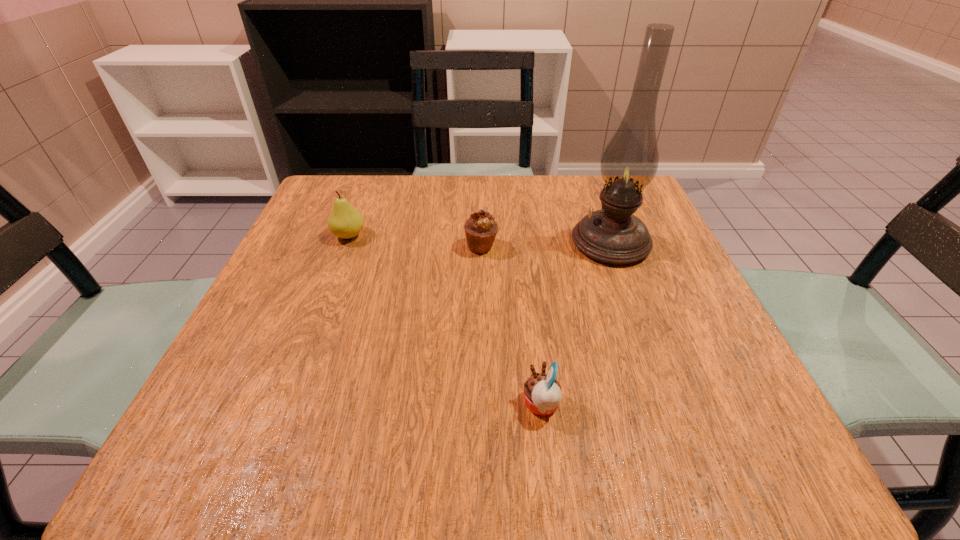
Where is `blank region between the farther muffin and the leftmost object`? This screenshot has height=540, width=960. blank region between the farther muffin and the leftmost object is located at coordinates (415, 241).

Where is `vacant area that lies between the oil lamp and the third object from left to right`? vacant area that lies between the oil lamp and the third object from left to right is located at coordinates (576, 323).

You are a GUI agent. You are given a task and a screenshot of the screen. Output one action in this format:
    pyautogui.click(x=<x>, y=<y>)
    Task: Click on the free space that is in between the leftmost object and the third object from right to left
    Image resolution: width=960 pixels, height=540 pixels.
    Given the screenshot: What is the action you would take?
    (415, 241)

Locate an element on the screen. This screenshot has height=540, width=960. vacant space that is in between the leftmost object and the farther muffin is located at coordinates (415, 241).

At what (x,y) coordinates should I click in order to perform the action: click on free space between the farther muffin and the pear. Please return your answer as a coordinate pair (x, y). This screenshot has height=540, width=960. Looking at the image, I should click on (415, 241).

At what (x,y) coordinates should I click in order to perform the action: click on the third closest object to the rightmost object. Please return your answer as a coordinate pair (x, y). Image resolution: width=960 pixels, height=540 pixels. Looking at the image, I should click on (345, 221).

Locate an element on the screen. The height and width of the screenshot is (540, 960). object identified as the third closest to the left muffin is located at coordinates 542,392.

Find the location of a particular element. The image size is (960, 540). vacant space that satisfies the following two spatial constraints: 1. on the front side of the leftmost object; 2. on the right side of the tallest object is located at coordinates pos(347,242).

Locate an element on the screen. free spot that satisfies the following two spatial constraints: 1. on the front side of the oil lamp; 2. on the right side of the leftmost object is located at coordinates (347, 242).